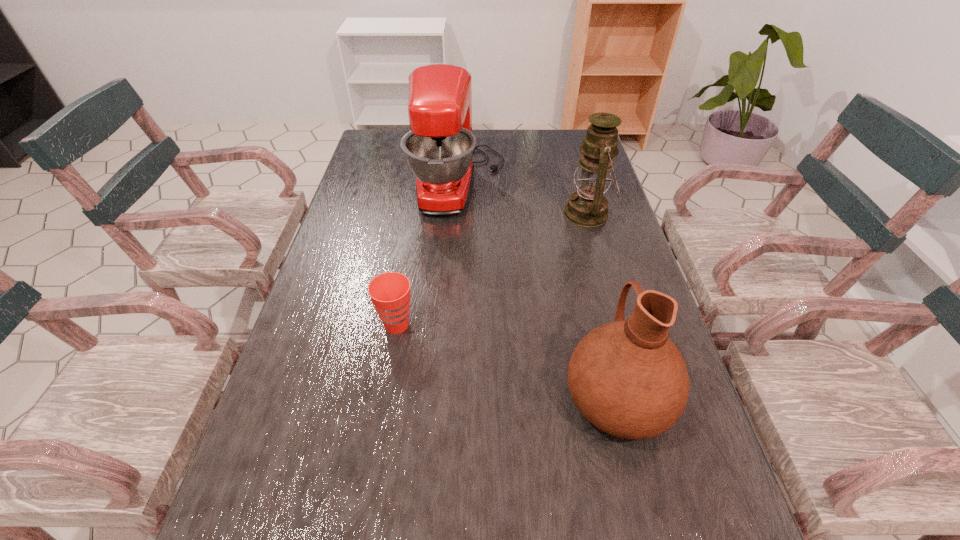
You are a GUI agent. You are given a task and a screenshot of the screen. Output one action in this format:
    pyautogui.click(x=<x>, y=<y>)
    Task: Click on the vacant region between the nearest object and the kitchen mixer
    The height and width of the screenshot is (540, 960).
    Given the screenshot: What is the action you would take?
    pyautogui.click(x=538, y=290)

This screenshot has width=960, height=540. Find the location of `free space between the second nearest object and the kitchen mixer`. free space between the second nearest object and the kitchen mixer is located at coordinates (428, 254).

Locate an element on the screen. free space between the oil lamp and the pitcher is located at coordinates (603, 305).

At what (x,y) coordinates should I click in order to perform the action: click on free spot between the kitchen mixer and the oil lamp. Please return your answer as a coordinate pair (x, y). This screenshot has height=540, width=960. Looking at the image, I should click on (523, 199).

In order to click on empty space between the oil lamp and the nearest object in this screenshot , I will do `click(603, 305)`.

Identify the location of empty space that is in between the kitchen mixer and the oil lamp. Image resolution: width=960 pixels, height=540 pixels. pos(523,199).

Image resolution: width=960 pixels, height=540 pixels. In order to click on free space between the nearest object and the kitchen mixer in this screenshot , I will do `click(538, 290)`.

At what (x,y) coordinates should I click in order to perform the action: click on object that stands as the closest to the nearest object. Please return your answer as a coordinate pair (x, y). Looking at the image, I should click on (390, 293).

Where is `the third closest object to the nearest object`? This screenshot has height=540, width=960. the third closest object to the nearest object is located at coordinates [x=439, y=149].

Identify the location of vacant region that satisfies the following two spatial constraints: 1. on the front-facing side of the oil lamp; 2. on the right side of the kitchen mixer. The width and height of the screenshot is (960, 540). (457, 214).